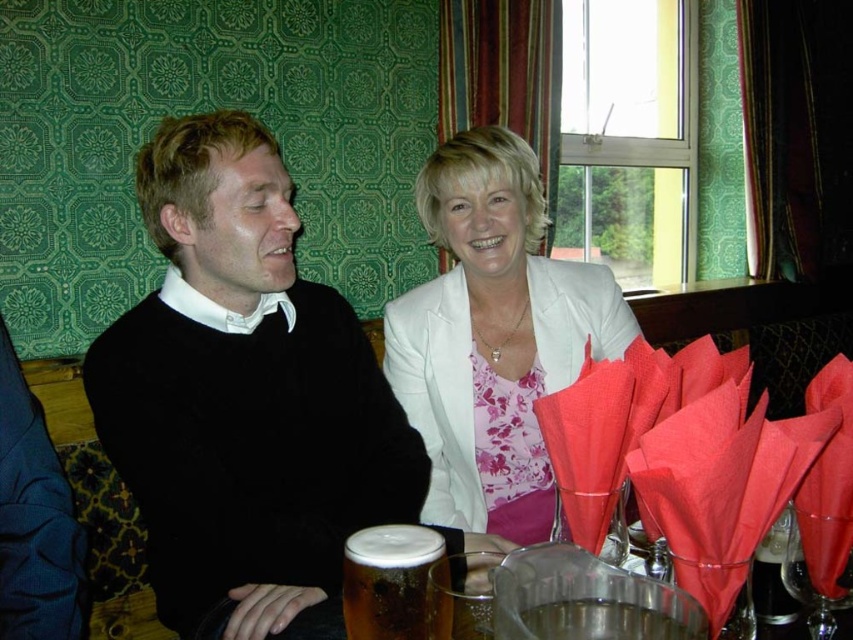
Question: Considering the relative positions of black sweater at left and white satin blazer at center in the image provided, where is black sweater at left located with respect to white satin blazer at center?

Choices:
 (A) left
 (B) right

Answer: (A)

Question: Does white satin blazer at center have a larger size compared to translucent glass beer at center?

Choices:
 (A) yes
 (B) no

Answer: (A)

Question: Which point is closer to the camera?

Choices:
 (A) (99, 416)
 (B) (376, 611)

Answer: (B)

Question: Which point is farther from the camera taking this photo?

Choices:
 (A) (577, 621)
 (B) (556, 308)
 (C) (376, 532)

Answer: (B)

Question: Which is farther from the black sweater at left?

Choices:
 (A) translucent glass beer at center
 (B) foamy amber liquid at lower center
 (C) white satin blazer at center

Answer: (A)

Question: Is foamy amber liquid at lower center closer to the viewer compared to translucent glass beer at center?

Choices:
 (A) no
 (B) yes

Answer: (A)